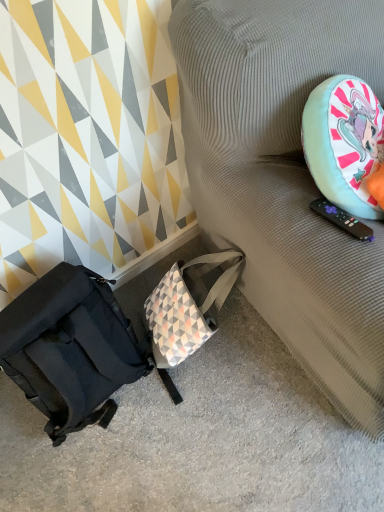
Locate an element on the screen. vacant area to the right of matte black backpack at lower left is located at coordinates (229, 413).